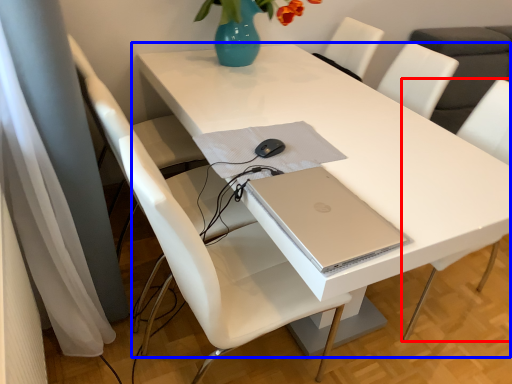
Question: Which object appears closest to the camera in this image, chair (highlighted by a red box) or table (highlighted by a blue box)?

Choices:
 (A) chair
 (B) table

Answer: (B)